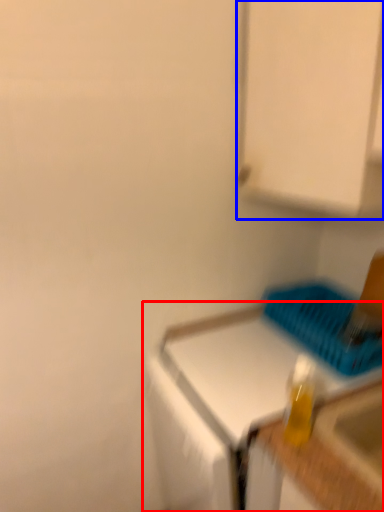
Question: Which object appears farthest to the camera in this image, countertop (highlighted by a red box) or cabinetry (highlighted by a blue box)?

Choices:
 (A) countertop
 (B) cabinetry

Answer: (A)